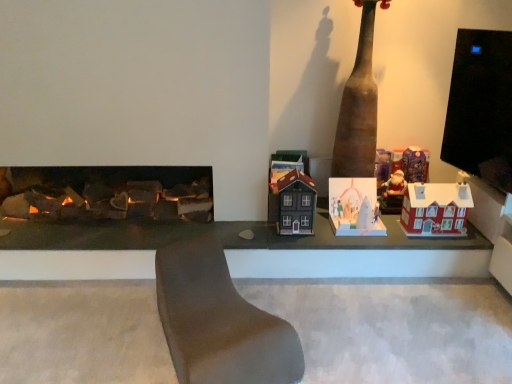
Locate an element on the screen. This screenshot has width=512, height=384. spots to the right of brown leather couch at center is located at coordinates (343, 331).